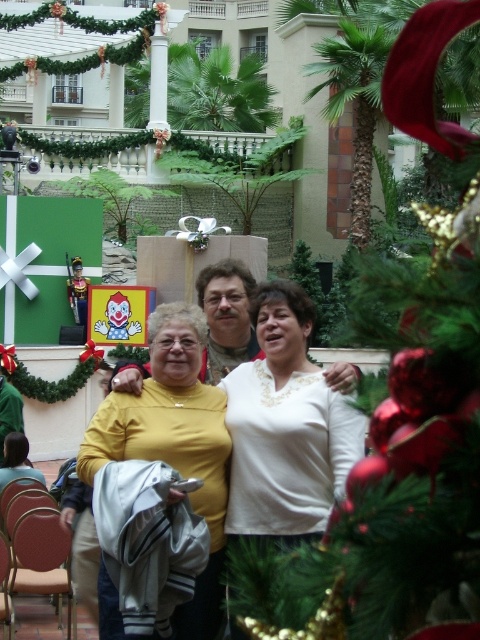
Question: Which of the following is the closest to the observer?

Choices:
 (A) (120, 417)
 (B) (212, 362)
 (C) (271, 362)

Answer: (A)

Question: Where is white matte sweater at center located in relation to yellow matte shirt at center in the image?

Choices:
 (A) left
 (B) right

Answer: (B)

Question: Which point is closer to the camera?

Choices:
 (A) (235, 280)
 (B) (308, 412)
 (C) (184, 625)

Answer: (C)

Question: Which point appears farthest from the camera in this image?

Choices:
 (A) (339, 381)
 (B) (332, 500)

Answer: (A)

Question: Is white matte sweater at center below yellow knit sweater at center?

Choices:
 (A) yes
 (B) no

Answer: (A)

Question: Is white matte sweater at center wider than yellow knit sweater at center?

Choices:
 (A) yes
 (B) no

Answer: (B)